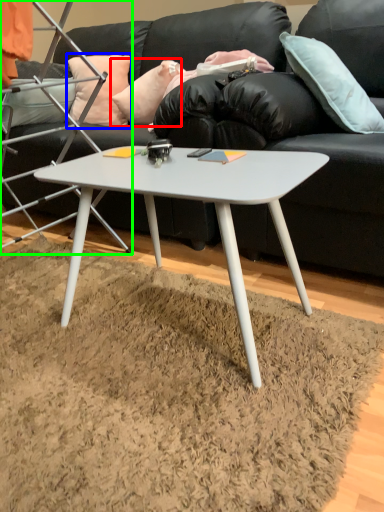
Question: Considering the real-world distances, which object is closest to pillow (highlighted by a red box)? pillow (highlighted by a blue box) or chair (highlighted by a green box).

Choices:
 (A) pillow
 (B) chair

Answer: (A)